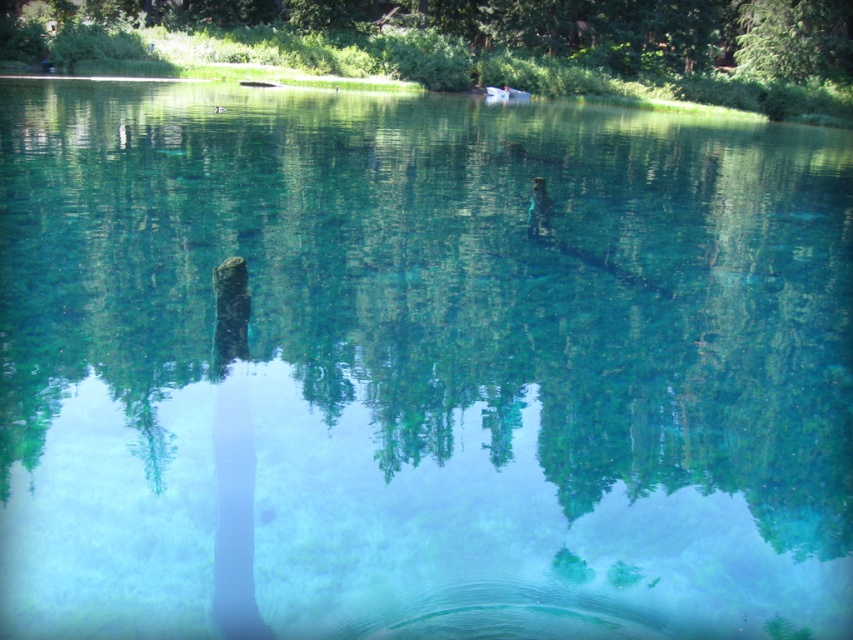
Question: Which object is farther from the camera taking this photo?

Choices:
 (A) green matte tree at upper center
 (B) green leafy tree at upper right
 (C) black matte tree trunk at center

Answer: (B)

Question: Is green matte tree at upper center wider than green leafy tree at upper right?

Choices:
 (A) no
 (B) yes

Answer: (B)

Question: Does green matte tree at upper center have a greater width compared to green leafy tree at upper right?

Choices:
 (A) no
 (B) yes

Answer: (B)

Question: Based on their relative distances, which object is nearer to the black matte tree trunk at center?

Choices:
 (A) green matte tree at upper center
 (B) green leafy tree at upper right

Answer: (A)

Question: Is black matte tree trunk at center thinner than green leafy tree at upper right?

Choices:
 (A) no
 (B) yes

Answer: (B)

Question: Which object is the farthest from the green matte tree at upper center?

Choices:
 (A) black matte tree trunk at center
 (B) green leafy tree at upper right

Answer: (A)